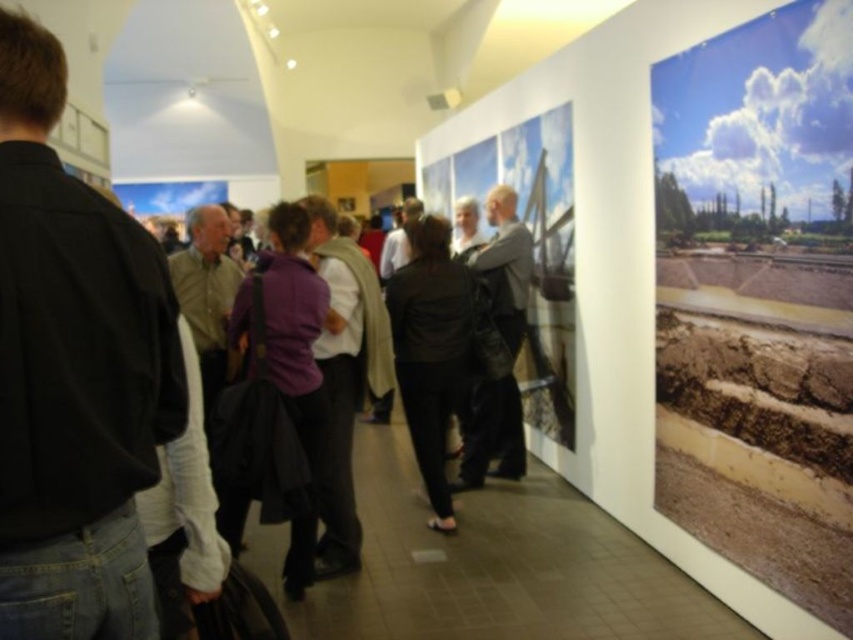
You are an event organizer at the exhibition and need to place a 2.5 meter long banner between the black shirt at left and the light brown leather jacket at center. Is there enough space between them to fit the banner?

The distance between the black shirt at left and the light brown leather jacket at center is 3.42 meters, which is greater than the 2.5 meter length of the banner. Therefore, there is sufficient space to place the banner between them.

You are an event organizer at the exhibition and need to place a 10 feet long banner between the black shirt at left and the black matte jacket at center. Is there enough space between them to fit the banner?

The distance between the black shirt at left and the black matte jacket at center is 8.44 feet, which is shorter than the 10 feet long banner. Therefore, the banner cannot be placed between them without overlapping.